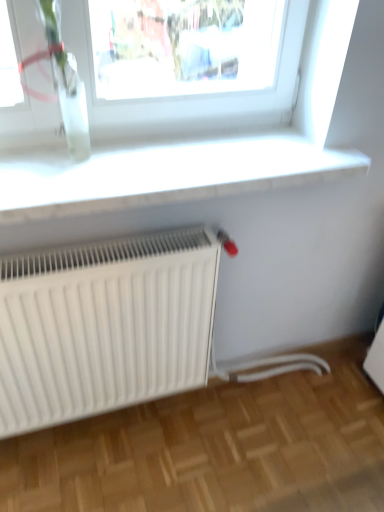
Question: Visually, is clear glass vase at upper left positioned to the left or to the right of white smooth window sill at upper center?

Choices:
 (A) right
 (B) left

Answer: (B)

Question: Based on their sizes in the image, would you say clear glass vase at upper left is bigger or smaller than white smooth window sill at upper center?

Choices:
 (A) big
 (B) small

Answer: (B)

Question: Estimate the real-world distances between objects in this image. Which object is closer to the white smooth window sill at upper center?

Choices:
 (A) white matte radiator at lower left
 (B) clear glass vase at upper left

Answer: (B)

Question: Estimate the real-world distances between objects in this image. Which object is farther from the white smooth window sill at upper center?

Choices:
 (A) clear glass vase at upper left
 (B) white matte radiator at lower left

Answer: (B)